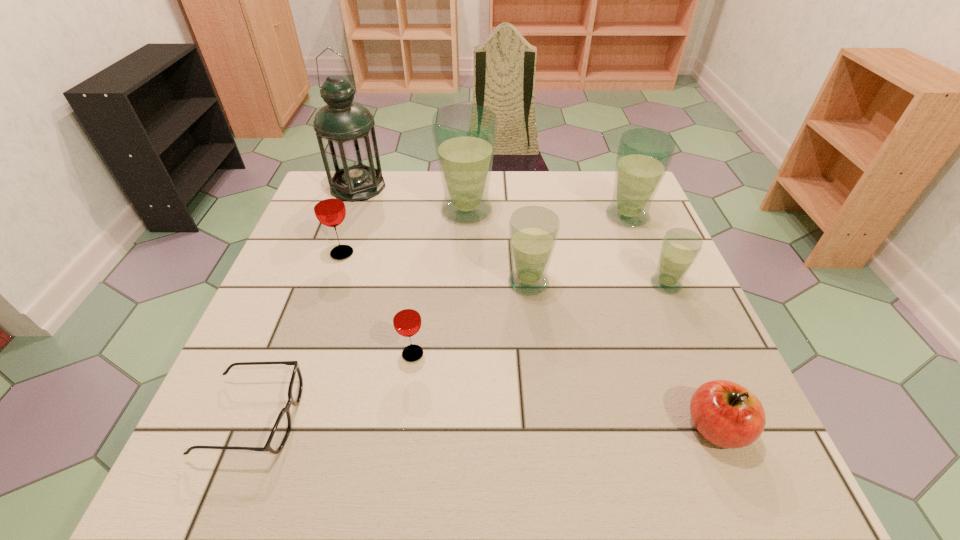
The image size is (960, 540). Identify the location of free space located 0.370m on the front of the second smallest blue glass. (549, 465).

Find the location of a particular element. free space located on the back of the smallest blue glass is located at coordinates (635, 211).

In order to click on vacant area situated on the left of the nearest glass in this screenshot , I will do `click(249, 354)`.

The image size is (960, 540). Identify the location of free point located on the back of the red apple. (682, 343).

Locate an element on the screen. The height and width of the screenshot is (540, 960). vacant space situated 0.240m on the front-facing side of the spectacles is located at coordinates 434,417.

Identify the location of oil lamp that is at the far edge. This screenshot has width=960, height=540. (345, 132).

At what (x,y) coordinates should I click in order to perform the action: click on apple that is at the near edge. Please return your answer as a coordinate pair (x, y). Image resolution: width=960 pixels, height=540 pixels. Looking at the image, I should click on (726, 414).

Locate an element on the screen. This screenshot has height=540, width=960. spectacles that is positioned at the near edge is located at coordinates (280, 432).

At what (x,y) coordinates should I click in order to perform the action: click on oil lamp that is at the left edge. Please return your answer as a coordinate pair (x, y). The width and height of the screenshot is (960, 540). Looking at the image, I should click on (345, 132).

You are a GUI agent. You are given a task and a screenshot of the screen. Output one action in this format:
    pyautogui.click(x=<x>, y=<y>)
    Task: Click on the glass present at the left edge
    This screenshot has height=540, width=960.
    Given the screenshot: What is the action you would take?
    pyautogui.click(x=329, y=208)